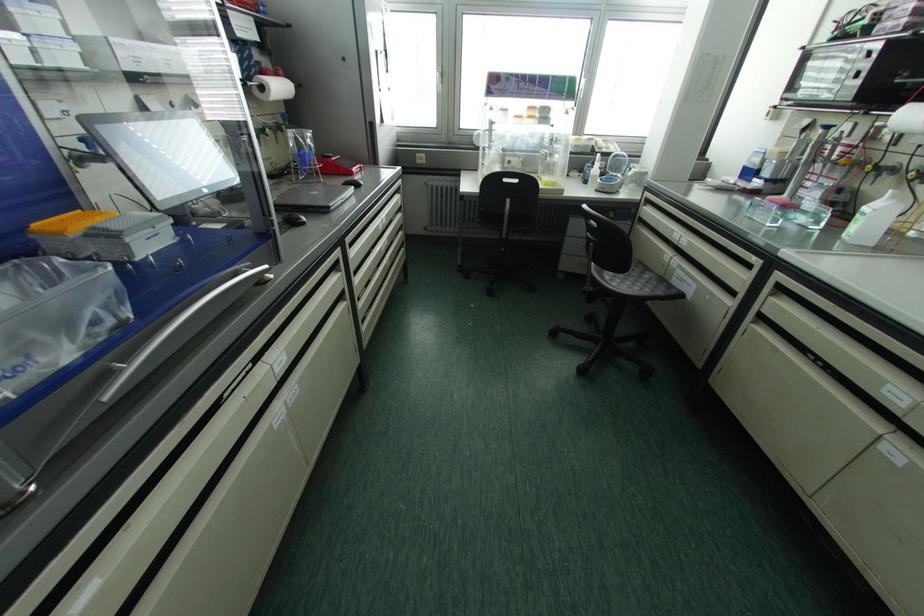
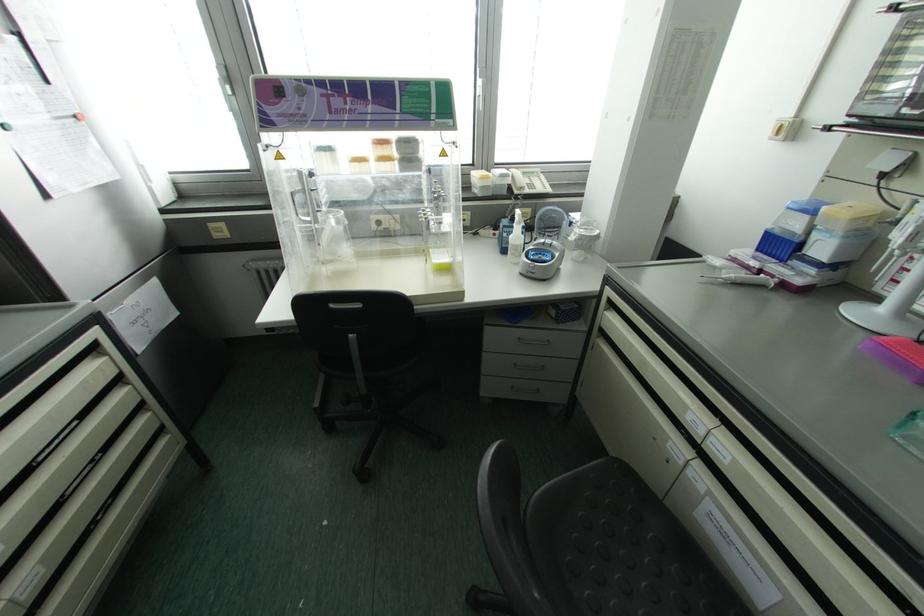
Find the pixel in the second image that matches point 784,195 in the first image.

(881, 309)